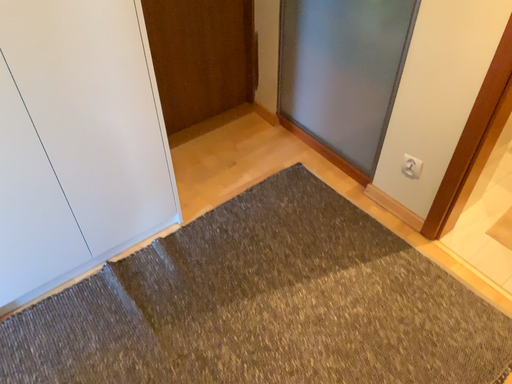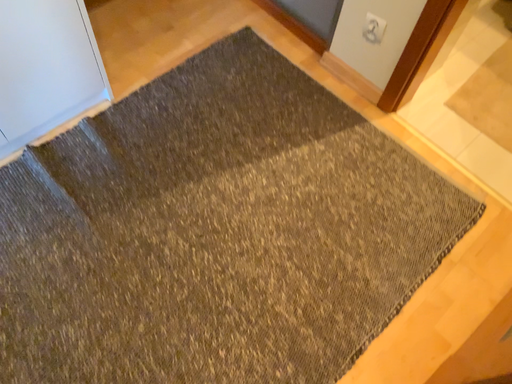
Question: How did the camera likely rotate when shooting the video?

Choices:
 (A) rotated downward
 (B) rotated upward

Answer: (A)